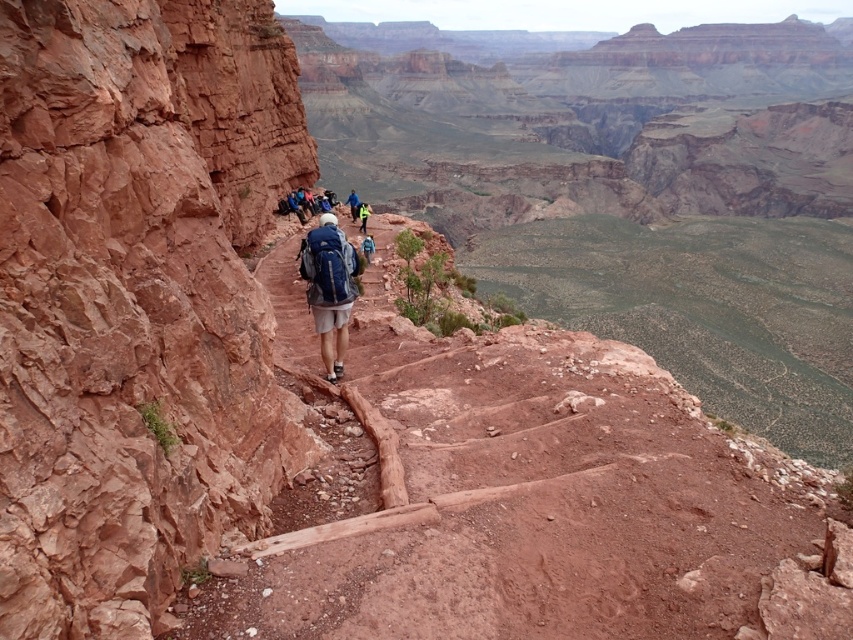
Question: Estimate the real-world distances between objects in this image. Which object is closer to the blue backpack at center?

Choices:
 (A) reflective blue jacket at center
 (B) rustic rock cliff at left

Answer: (A)

Question: Which point is farther from the camera taking this photo?

Choices:
 (A) (357, 216)
 (B) (152, 54)

Answer: (A)

Question: Can you confirm if blue backpack at center is positioned above reflective blue jacket at center?

Choices:
 (A) yes
 (B) no

Answer: (A)

Question: Does rustic rock cliff at left appear under reflective blue jacket at center?

Choices:
 (A) yes
 (B) no

Answer: (A)

Question: Which of the following is the farthest from the observer?

Choices:
 (A) (364, 204)
 (B) (129, 58)
 (C) (352, 205)
 (D) (339, 282)

Answer: (C)

Question: Can you confirm if rustic rock cliff at left is positioned below reflective blue jacket at center?

Choices:
 (A) yes
 (B) no

Answer: (A)